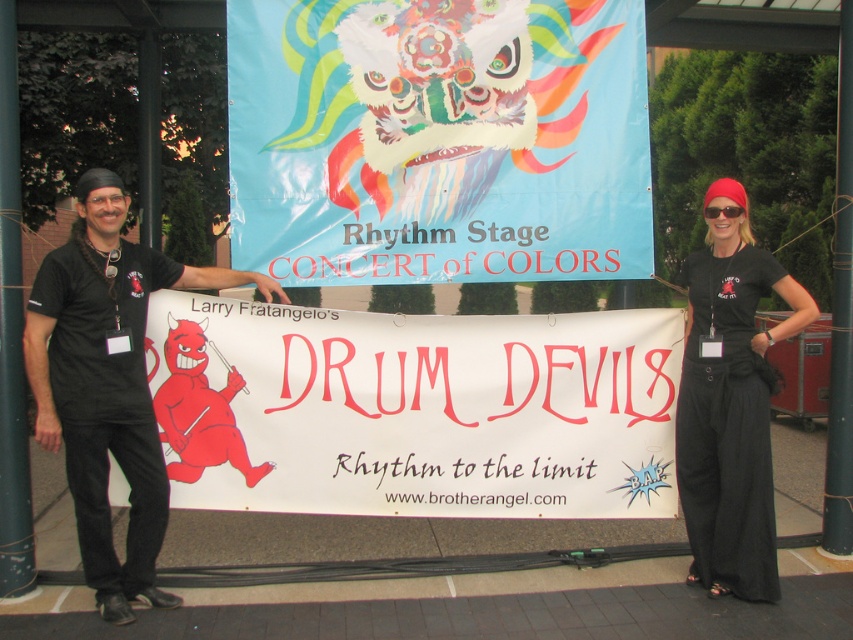
Question: Is turquoise glossy banner at center positioned in front of black matte shirt at left?

Choices:
 (A) no
 (B) yes

Answer: (A)

Question: Considering the relative positions of turquoise glossy banner at center and black cotton t-shirt at center in the image provided, where is turquoise glossy banner at center located with respect to black cotton t-shirt at center?

Choices:
 (A) above
 (B) below

Answer: (A)

Question: Can you confirm if white paper banner at center is bigger than black plastic goggles at upper center?

Choices:
 (A) no
 (B) yes

Answer: (B)

Question: Among these objects, which one is nearest to the camera?

Choices:
 (A) black plastic goggles at upper center
 (B) black matte shirt at left

Answer: (B)

Question: Which object is the farthest from the turquoise glossy banner at center?

Choices:
 (A) black plastic goggles at upper center
 (B) black matte shirt at left

Answer: (A)

Question: Which point is farther to the camera?

Choices:
 (A) black cotton t-shirt at center
 (B) turquoise glossy banner at center

Answer: (B)